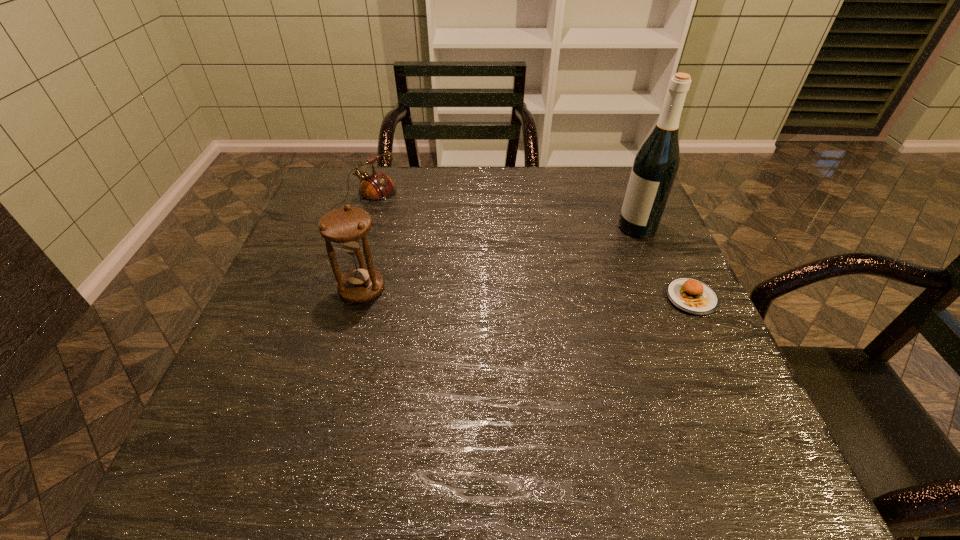
You are a GUI agent. You are given a task and a screenshot of the screen. Output one action in this format:
    pyautogui.click(x=<x>, y=<y>)
    Task: Click on the vacant region between the telephone and the food
    
    Given the screenshot: What is the action you would take?
    pyautogui.click(x=528, y=251)

Where is `blank region between the tallest object and the hourglass`? Image resolution: width=960 pixels, height=540 pixels. blank region between the tallest object and the hourglass is located at coordinates (499, 258).

Locate an element on the screen. The height and width of the screenshot is (540, 960). free spot between the hourglass and the shortest object is located at coordinates (527, 294).

Locate an element on the screen. This screenshot has width=960, height=540. vacant space in between the telephone and the second tallest object is located at coordinates (363, 247).

Identify the location of free space that is in between the second tallest object and the tallest object. (499, 258).

Select which object is the third closest to the second shortest object. Please provide its 2D coordinates. Your answer should be formatted as a tuple, i.e. [(x, y)], where the tuple contains the x and y coordinates of a point satisfying the conditions above.

[(694, 297)]

Locate an element on the screen. object that can be found as the third closest to the wine bottle is located at coordinates (375, 187).

This screenshot has width=960, height=540. I want to click on vacant space that satisfies the following two spatial constraints: 1. on the front side of the telephone; 2. on the left side of the hourglass, so click(x=336, y=289).